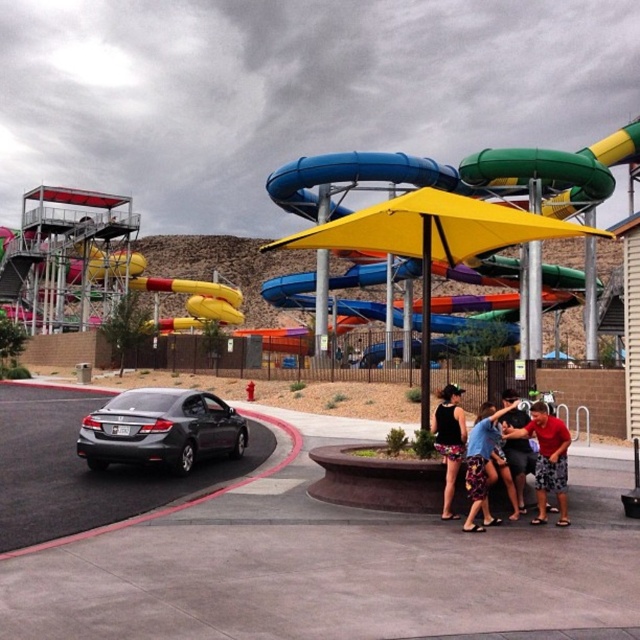
Question: Considering the relative positions of matte black sedan at left and floral skirt at lower center in the image provided, where is matte black sedan at left located with respect to floral skirt at lower center?

Choices:
 (A) right
 (B) left

Answer: (B)

Question: Which of the following is the closest to the observer?

Choices:
 (A) black matte dress at center
 (B) matte black sedan at left
 (C) matte black shirt at lower right
 (D) red cotton shirt at lower right

Answer: (D)

Question: Observing the image, what is the correct spatial positioning of red cotton shirt at lower right in reference to black matte dress at center?

Choices:
 (A) left
 (B) right

Answer: (B)

Question: Is yellow fabric umbrella at center closer to camera compared to black matte dress at center?

Choices:
 (A) yes
 (B) no

Answer: (B)

Question: Estimate the real-world distances between objects in this image. Which object is closer to the floral skirt at lower center?

Choices:
 (A) matte black sedan at left
 (B) matte black shirt at lower right
 (C) black matte dress at center

Answer: (C)

Question: Which point is closer to the camera?

Choices:
 (A) (550, 476)
 (B) (522, 513)
 (C) (140, 404)

Answer: (A)